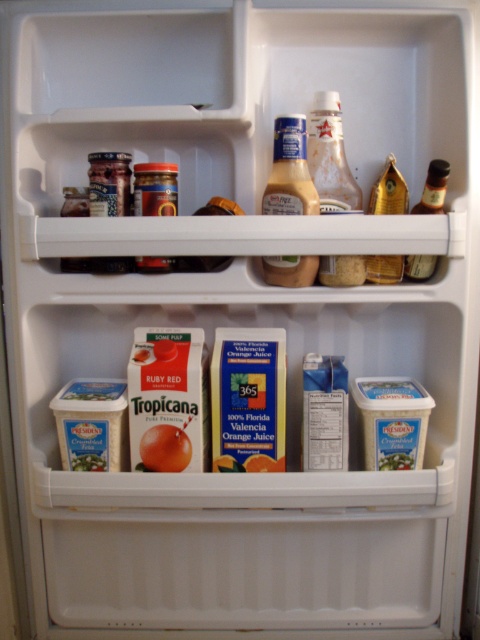
You need to grab the translucent glass bottle at upper right from the refrigerator. However, the matte plastic mustard at center is blocking your access. Can you move the mustard to reach the bottle?

The matte plastic mustard at center is located above the translucent glass bottle at upper right, so you can easily reach the translucent glass bottle at upper right without moving the mustard since it is below.

You need to place a new small jar of honey that is 10 cm in diameter into the refrigerator. Looking at the image, which object can you compare the honey jar to in order to determine if it will fit in the space between the matte plastic mustard at center and the translucent glass bottle at upper right?

The honey jar can be compared to the translucent glass bottle at upper right. Since the matte plastic mustard at center is larger than the translucent glass bottle at upper right, if the honey jar is smaller than the translucent glass bottle at upper right, it should fit in the space between them.

You are trying to place a 36 inch long item in the refrigerator. The translucent glass bottle at upper center is in the way. Can you move the item past it?

The distance between the translucent glass bottle at upper center and the other objects is 35.86 inches. Since the item is 36 inches long, it cannot fit through the space as there is insufficient clearance.